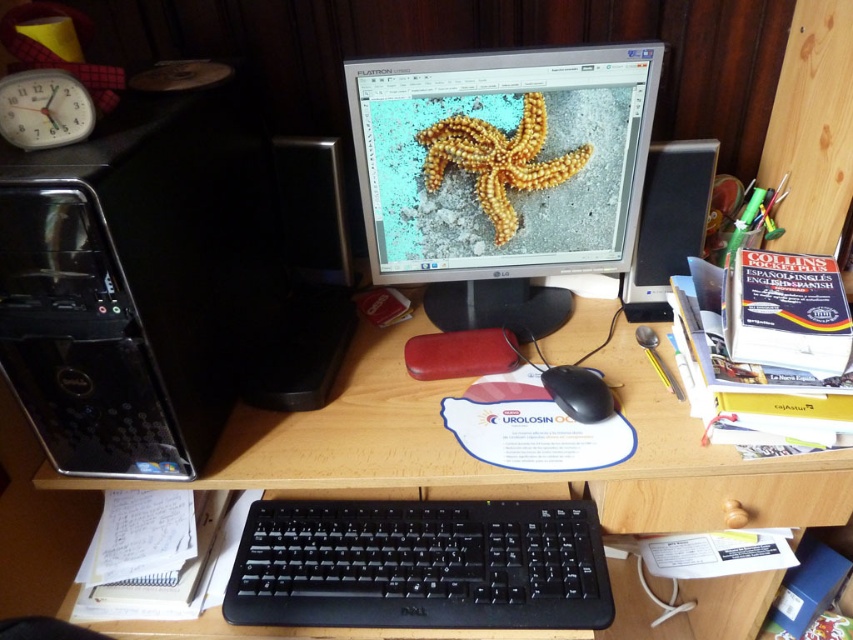
Does point (115, 186) come behind point (312, 296)?

No, (115, 186) is in front of (312, 296).

Does black plastic computer tower at left appear over black plastic speaker at left?

Yes.

Who is more distant from viewer, (257, 147) or (274, 339)?

The point (274, 339) is behind.

The width and height of the screenshot is (853, 640). Find the location of `black plastic computer tower at left`. black plastic computer tower at left is located at coordinates (136, 280).

Is point (734, 502) in front of point (540, 252)?

Yes.

Is point (67, 600) farther from camera compared to point (451, 218)?

That is False.

Locate an element on the screen. Image resolution: width=853 pixels, height=640 pixels. wooden at lower center is located at coordinates (416, 465).

Identify the location of wooden at lower center. This screenshot has width=853, height=640. (416, 465).

In the scene shown: Who is shorter, wooden at lower center or black plastic keyboard at center?

black plastic keyboard at center

This screenshot has height=640, width=853. Find the location of `wooden at lower center`. wooden at lower center is located at coordinates (416, 465).

The width and height of the screenshot is (853, 640). I want to click on wooden at lower center, so click(x=416, y=465).